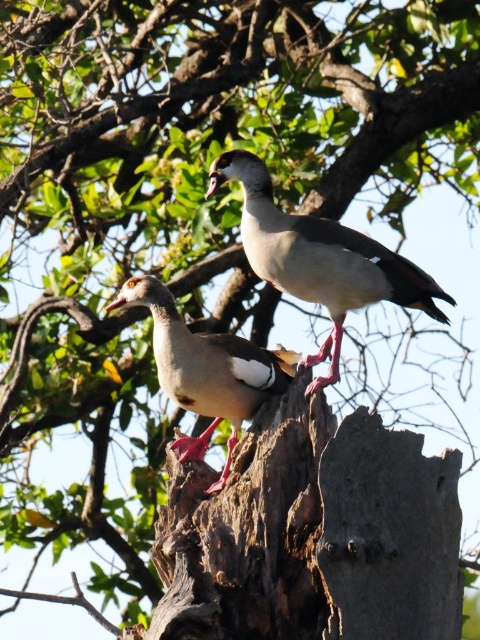
You are standing in front of the tree stump where the two Egyptian geese are perched. You notice two points marked on the ground at coordinates point (253, 618) and point (244, 358). Which point is closer to you?

Point (253, 618) is in front of point (244, 358), so it is closer to you.

You are a wildlife photographer aiming to capture both the white feathered duck at center and the brown feathered duck at center in a single frame. Given their sizes, which duck will appear larger in your photo?

The white feathered duck at center will appear larger in the photo because it is bigger than the brown feathered duck at center.